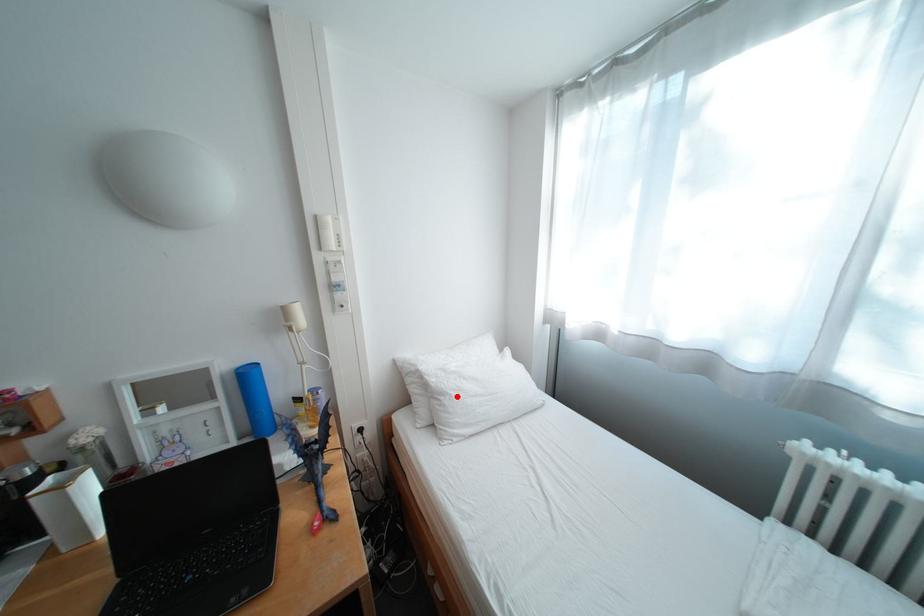
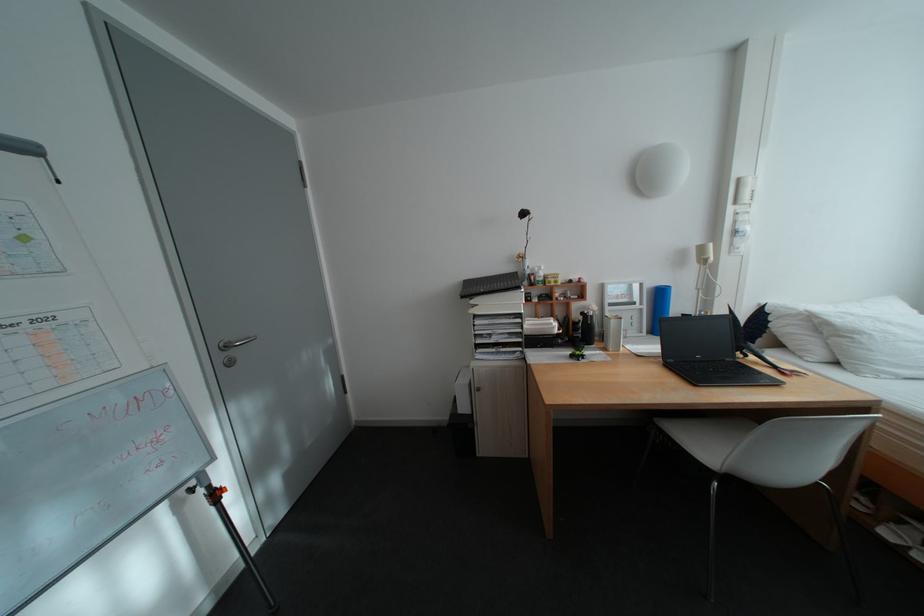
Question: I am providing you with two images of the same scene from different viewpoints. In image1, a red point is highlighted. Considering the same 3D point in image2, which of the following is correct?

Choices:
 (A) It is closer
 (B) It is farther

Answer: (A)